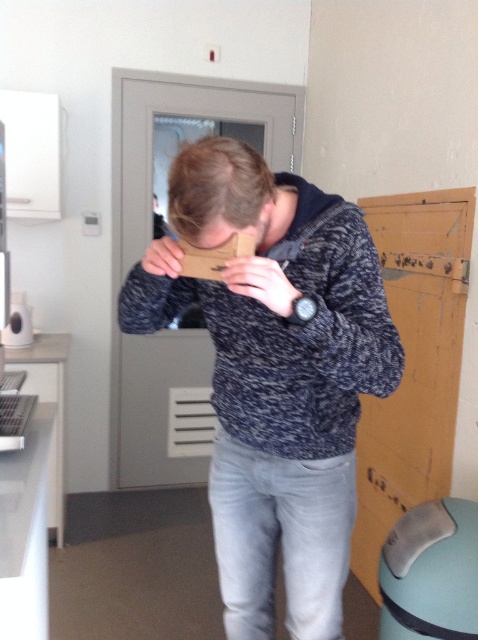
Does brown cardboard at center have a lesser width compared to matte brown paper at center?

No.

Find the location of `brown cardboard at center`. brown cardboard at center is located at coordinates (217, 184).

In the scene shown: Between matte gray sweater at center and matte cardboard at center, which one has less height?

matte cardboard at center is shorter.

Is point (234, 513) closer to camera compared to point (248, 230)?

That is False.

Image resolution: width=478 pixels, height=640 pixels. I want to click on matte gray sweater at center, so click(279, 381).

Is matte gray sweater at center below brown cardboard at center?

Yes, matte gray sweater at center is below brown cardboard at center.

Between matte gray sweater at center and brown cardboard at center, which one has more height?

Standing taller between the two is matte gray sweater at center.

This screenshot has height=640, width=478. Identify the location of matte gray sweater at center. (279, 381).

Identify the location of matte gray sweater at center. (279, 381).